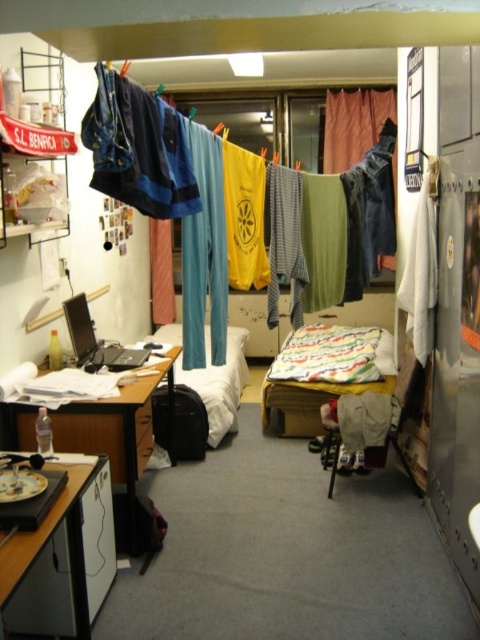
You are standing in the dormitory room and want to move from the wooden desk at left to the multicolored quilted bed at center. Which direction should you move to reach the bed?

Since the multicolored quilted bed at center is further to the viewer than the wooden desk at left, you should move forward towards the bed to reach it.

You are standing in the dormitory room and want to determine the relative positions of two points. The first point is at coordinates point (252, 349) and the second is at point (238, 392). Which point is closer to you?

Point (252, 349) is further to the camera than point (238, 392), so the second point is closer to you.